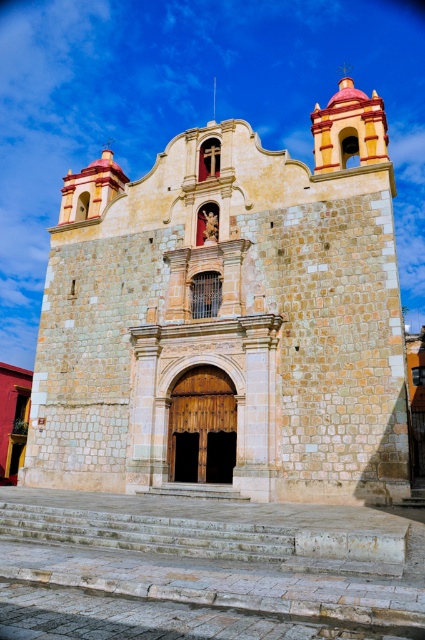
Question: Can you confirm if beige stone church at center is bigger than stone steps at center?

Choices:
 (A) no
 (B) yes

Answer: (B)

Question: Which point appears farthest from the camera in this image?

Choices:
 (A) (291, 195)
 (B) (243, 499)
 (C) (115, 541)

Answer: (A)

Question: Among these points, which one is farthest from the camera?

Choices:
 (A) (180, 490)
 (B) (184, 332)
 (C) (189, 548)

Answer: (B)

Question: Observing the image, what is the correct spatial positioning of beige stone church at center in reference to white stone stairs at center?

Choices:
 (A) above
 (B) below

Answer: (A)

Question: Is stone steps at center thinner than white stone stairs at center?

Choices:
 (A) no
 (B) yes

Answer: (A)

Question: Which of the following is the closest to the observer?

Choices:
 (A) stone steps at center
 (B) white stone stairs at center
 (C) beige stone church at center

Answer: (A)